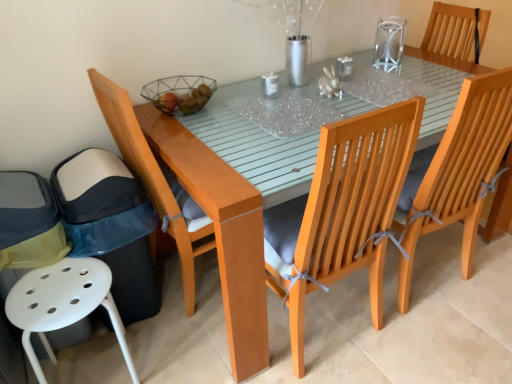
You are a GUI agent. You are given a task and a screenshot of the screen. Output one action in this format:
    pyautogui.click(x=<x>, y=<y>)
    Task: Click on the free space between clear glass vase at upper right and transparent glass table at upper center, which ranks as the first glass table in right-to-left order
    
    Given the screenshot: What is the action you would take?
    pyautogui.click(x=412, y=71)